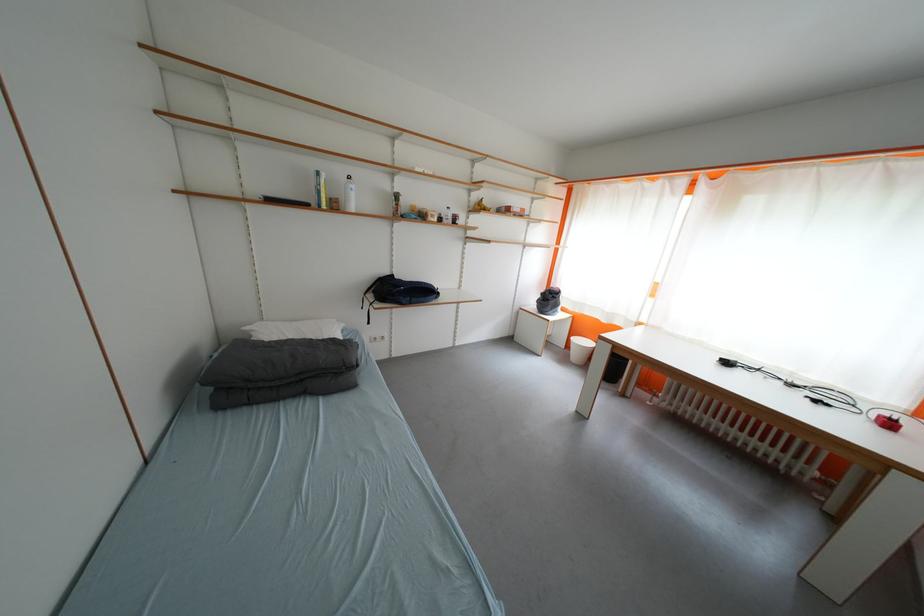
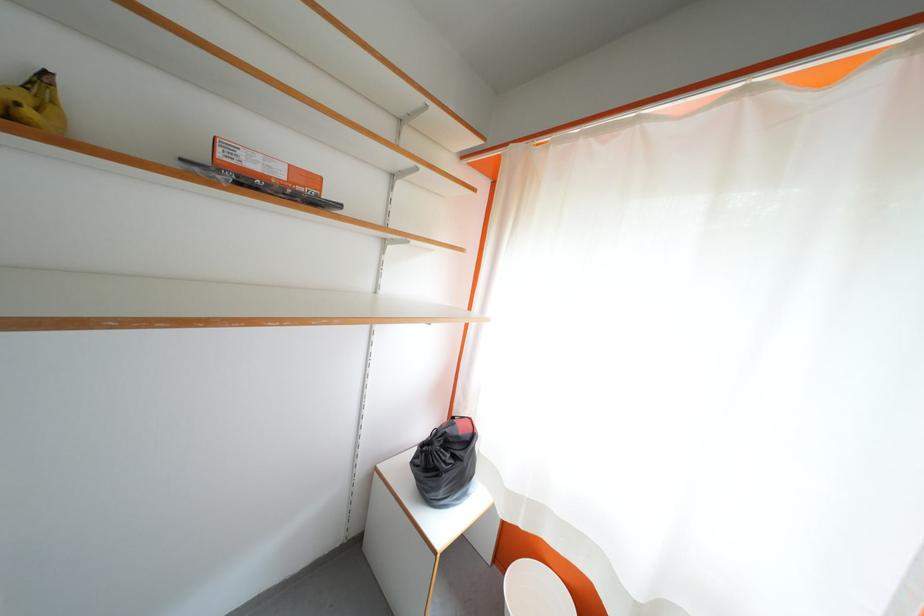
Where in the second image is the point corresponding to (528,214) from the first image?

(289, 177)